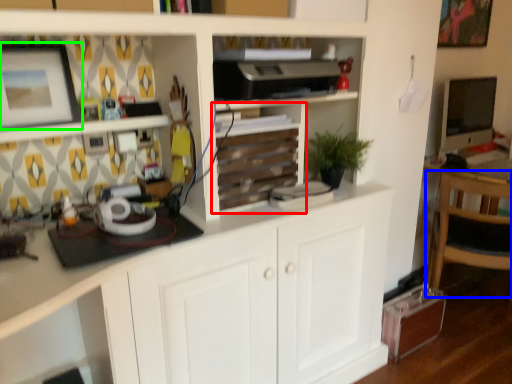
Question: Which is farther away from shelf (highlighted by a red box)? chair (highlighted by a blue box) or picture frame (highlighted by a green box)?

Choices:
 (A) chair
 (B) picture frame

Answer: (A)